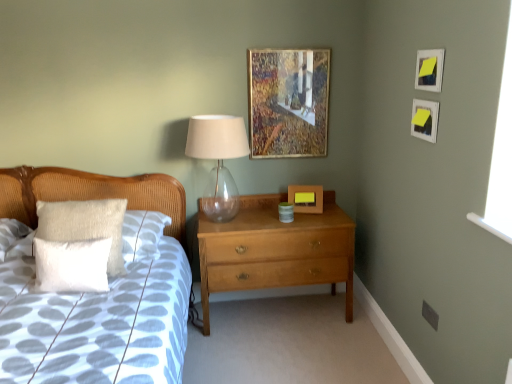
Question: From a real-world perspective, is matte white picture frame at upper right, which is counted as the fourth picture frame, starting from the left, beneath white textured pillow at left, placed as the second pillow when sorted from back to front?

Choices:
 (A) no
 (B) yes

Answer: (A)

Question: From the image's perspective, is matte white picture frame at upper right, acting as the 3th picture frame starting from the back, located above white textured pillow at left, which ranks as the first pillow in front-to-back order?

Choices:
 (A) yes
 (B) no

Answer: (A)

Question: Would you say white textured pillow at left, placed as the second pillow when sorted from back to front, is part of matte white picture frame at upper right, acting as the 3th picture frame starting from the back,'s contents?

Choices:
 (A) yes
 (B) no

Answer: (B)

Question: Does matte white picture frame at upper right, acting as the first picture frame starting from the right, appear on the right side of white textured pillow at left, placed as the second pillow when sorted from back to front?

Choices:
 (A) yes
 (B) no

Answer: (A)

Question: Does matte white picture frame at upper right, acting as the first picture frame starting from the right, come in front of white textured pillow at left, placed as the second pillow when sorted from back to front?

Choices:
 (A) yes
 (B) no

Answer: (A)

Question: From the image's perspective, does matte white picture frame at upper right, which is counted as the fourth picture frame, starting from the left, appear lower than white textured pillow at left, which ranks as the first pillow in front-to-back order?

Choices:
 (A) yes
 (B) no

Answer: (B)

Question: Can you confirm if white textured pillow at left, placed as the second pillow when sorted from back to front, is wider than yellow paper at upper right, the second picture frame positioned from the right?

Choices:
 (A) yes
 (B) no

Answer: (A)

Question: Is white textured pillow at left, which ranks as the first pillow in front-to-back order, looking in the opposite direction of yellow paper at upper right, placed as the third picture frame when sorted from left to right?

Choices:
 (A) no
 (B) yes

Answer: (A)

Question: From the image's perspective, is white textured pillow at left, placed as the second pillow when sorted from back to front, under yellow paper at upper right, the second picture frame positioned from the right?

Choices:
 (A) no
 (B) yes

Answer: (B)

Question: Are white textured pillow at left, which ranks as the first pillow in front-to-back order, and yellow paper at upper right, the second picture frame positioned from the right, located far from each other?

Choices:
 (A) yes
 (B) no

Answer: (A)

Question: Considering the relative positions of white textured pillow at left, which ranks as the first pillow in front-to-back order, and yellow paper at upper right, acting as the 1th picture frame starting from the front, in the image provided, is white textured pillow at left, which ranks as the first pillow in front-to-back order, in front of yellow paper at upper right, acting as the 1th picture frame starting from the front,?

Choices:
 (A) no
 (B) yes

Answer: (A)

Question: Considering the relative sizes of white textured pillow at left, which ranks as the first pillow in front-to-back order, and yellow paper at upper right, which ranks as the fourth picture frame in back-to-front order, in the image provided, is white textured pillow at left, which ranks as the first pillow in front-to-back order, shorter than yellow paper at upper right, which ranks as the fourth picture frame in back-to-front order,?

Choices:
 (A) no
 (B) yes

Answer: (A)

Question: Is transparent glass table lamp at center smaller than matte white picture frame at upper right, acting as the 3th picture frame starting from the back?

Choices:
 (A) yes
 (B) no

Answer: (B)